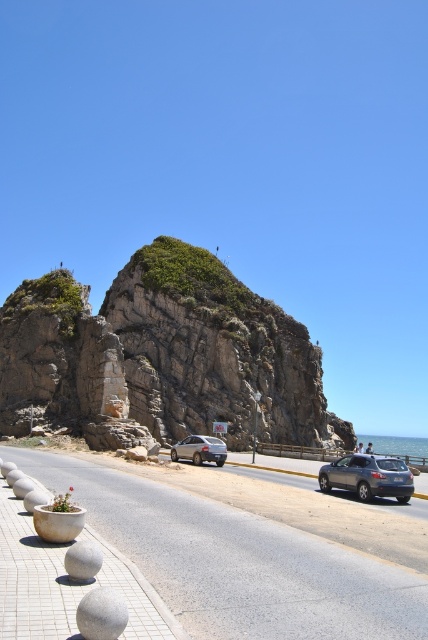
Question: Can you confirm if satin silver suv at center is bigger than gray stone at lower left?

Choices:
 (A) yes
 (B) no

Answer: (A)

Question: Does white smooth sphere at lower left appear on the right side of white marble planter at lower left?

Choices:
 (A) yes
 (B) no

Answer: (A)

Question: Which of the following is the closest to the observer?

Choices:
 (A) (259, 362)
 (B) (82, 579)
 (C) (371, 476)

Answer: (B)

Question: Which of the following is the farthest from the observer?

Choices:
 (A) (238, 561)
 (B) (347, 426)
 (C) (327, 474)

Answer: (B)

Question: Does gray asphalt highway at center have a lesser width compared to gray stone at lower left?

Choices:
 (A) yes
 (B) no

Answer: (B)

Question: Estimate the real-world distances between objects in this image. Which object is closer to the gray asphalt highway at center?

Choices:
 (A) white smooth sphere at lower left
 (B) satin silver suv at center
 (C) satin silver sedan at center
 (D) rocky cliff at upper center

Answer: (A)